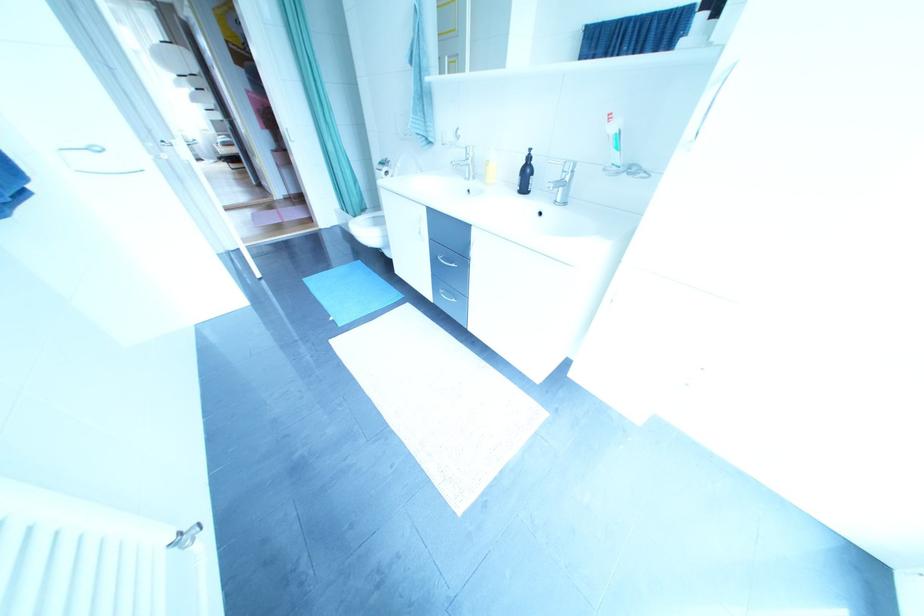
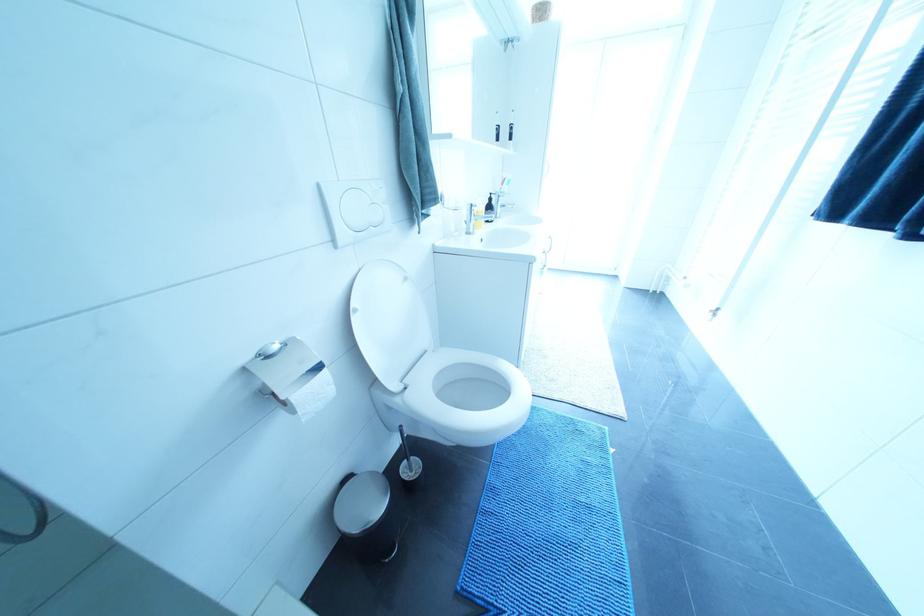
The point at [407,172] is marked in the first image. Where is the corresponding point in the second image?

(367, 314)